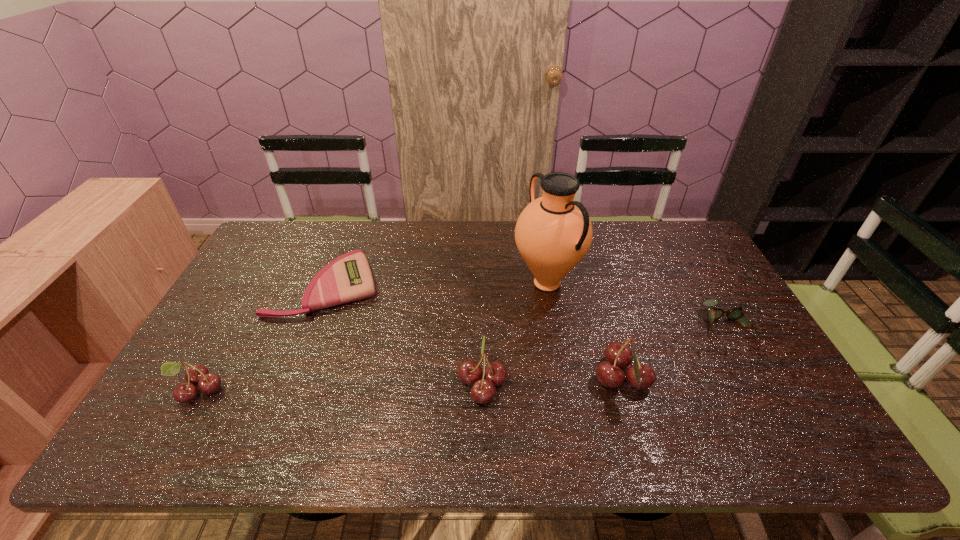
At what (x,y) coordinates should I click in order to perform the action: click on vacant region located 0.180m on the leaves of the third tallest object. Please return your answer as a coordinate pair (x, y). This screenshot has width=960, height=540. Looking at the image, I should click on (386, 383).

Image resolution: width=960 pixels, height=540 pixels. In order to click on vacant region located on the leaves of the third tallest object in this screenshot , I will do `click(310, 383)`.

Where is `vacant position located 0.230m on the leaves of the rightmost cherry`? The image size is (960, 540). vacant position located 0.230m on the leaves of the rightmost cherry is located at coordinates (742, 380).

You are a GUI agent. You are given a task and a screenshot of the screen. Output one action in this format:
    pyautogui.click(x=<x>, y=<y>)
    Task: Click on the vacant space located 0.180m on the front of the wristlet
    
    Given the screenshot: What is the action you would take?
    pyautogui.click(x=293, y=372)

Identify the location of free spot located 0.140m on the front-facing side of the second shortest object. The image size is (960, 540). (768, 401).

I want to click on free space located 0.260m on the left of the tallest object, so click(429, 283).

Where is `wristlet that is at the far edge`? wristlet that is at the far edge is located at coordinates (348, 278).

You are a GUI agent. You are given a task and a screenshot of the screen. Output one action in this format:
    pyautogui.click(x=<x>, y=<y>)
    Task: Click on the pitcher positioned at the far edge
    
    Given the screenshot: What is the action you would take?
    pyautogui.click(x=553, y=233)

This screenshot has height=540, width=960. Find the location of `cherry positioned at the left edge`. cherry positioned at the left edge is located at coordinates (197, 374).

Where is `wristlet situated at the left edge`? Image resolution: width=960 pixels, height=540 pixels. wristlet situated at the left edge is located at coordinates (348, 278).